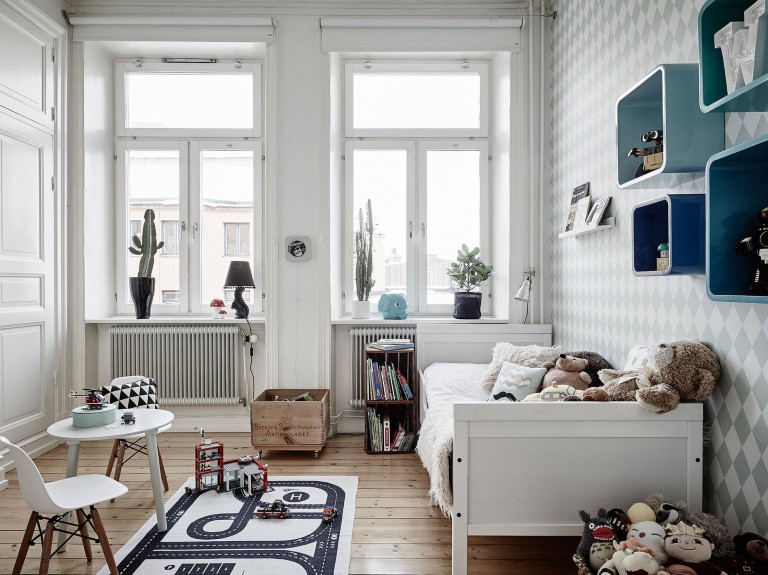
In order to click on vase in this screenshot , I will do `click(137, 292)`, `click(353, 310)`, `click(464, 306)`.